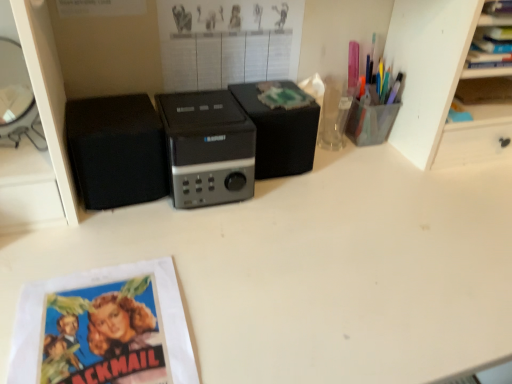
Question: Is matte black poster at upper center far away from translucent plastic pen holder at upper right?

Choices:
 (A) yes
 (B) no

Answer: (B)

Question: Can you confirm if matte black poster at upper center is thinner than translucent plastic pen holder at upper right?

Choices:
 (A) yes
 (B) no

Answer: (A)

Question: Considering the relative sizes of matte black poster at upper center and translucent plastic pen holder at upper right in the image provided, is matte black poster at upper center taller than translucent plastic pen holder at upper right?

Choices:
 (A) yes
 (B) no

Answer: (A)

Question: Does matte black poster at upper center have a lesser height compared to translucent plastic pen holder at upper right?

Choices:
 (A) no
 (B) yes

Answer: (A)

Question: Could you tell me if matte black poster at upper center is turned towards translucent plastic pen holder at upper right?

Choices:
 (A) yes
 (B) no

Answer: (B)

Question: Is matte black poster at upper center to the right of translucent plastic pen holder at upper right from the viewer's perspective?

Choices:
 (A) no
 (B) yes

Answer: (A)

Question: Can you confirm if blue paper at lower left is wider than translucent plastic pen holder at upper right?

Choices:
 (A) no
 (B) yes

Answer: (B)

Question: Is the depth of blue paper at lower left greater than that of translucent plastic pen holder at upper right?

Choices:
 (A) no
 (B) yes

Answer: (A)

Question: Does blue paper at lower left appear on the left side of translucent plastic pen holder at upper right?

Choices:
 (A) yes
 (B) no

Answer: (A)

Question: Is translucent plastic pen holder at upper right a part of blue paper at lower left?

Choices:
 (A) yes
 (B) no

Answer: (B)

Question: Is the depth of blue paper at lower left less than that of translucent plastic pen holder at upper right?

Choices:
 (A) yes
 (B) no

Answer: (A)

Question: From the image's perspective, is blue paper at lower left located beneath translucent plastic pen holder at upper right?

Choices:
 (A) yes
 (B) no

Answer: (A)

Question: Is black plastic speaker at center a part of black matte speaker at center, the 1th speaker when ordered from right to left?

Choices:
 (A) no
 (B) yes

Answer: (A)